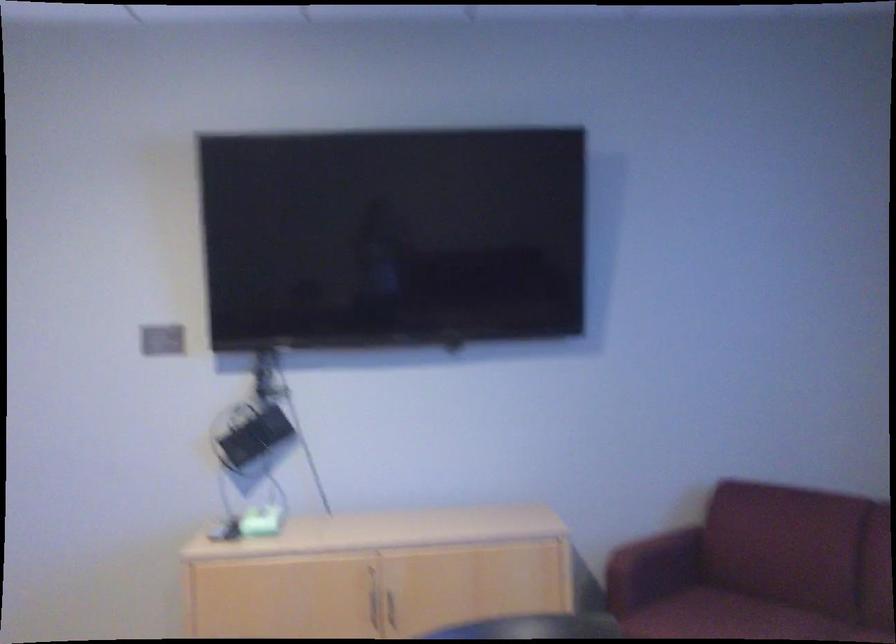
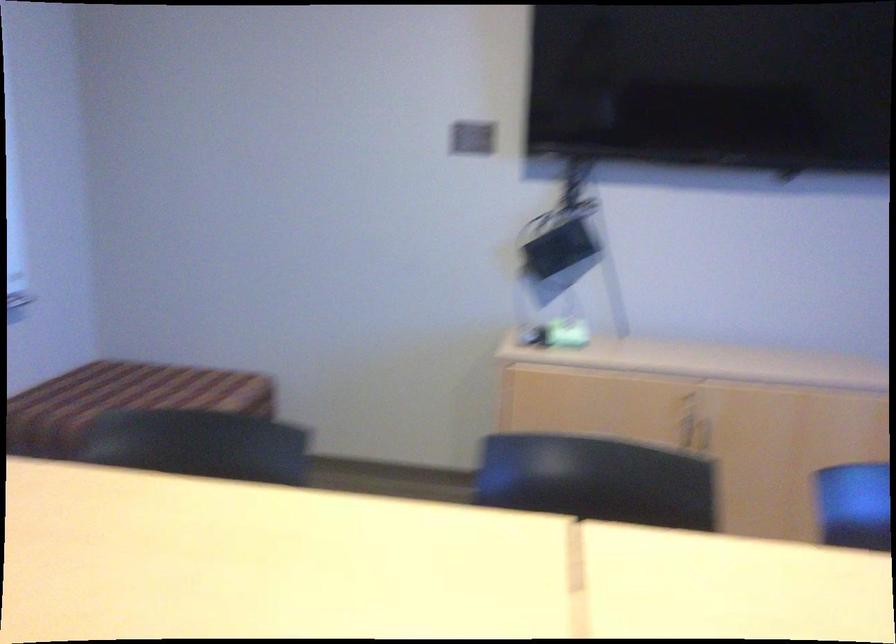
Question: The images are taken continuously from a first-person perspective. In which direction are you moving?

Choices:
 (A) Left
 (B) Right
 (C) Forward
 (D) Backward

Answer: (A)